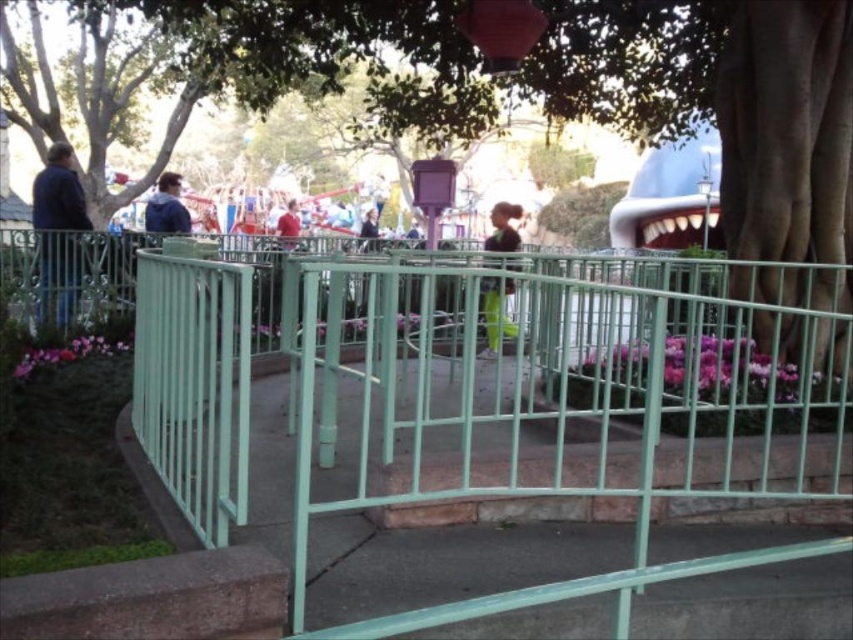
Question: Does red matte shirt at center appear on the left side of light brown leather jacket at center?

Choices:
 (A) yes
 (B) no

Answer: (A)

Question: Estimate the real-world distances between objects in this image. Which object is farther from the blue fabric jacket at upper left?

Choices:
 (A) dark blue jacket at left
 (B) green fabric pants at center

Answer: (B)

Question: Does green fabric pants at center have a smaller size compared to red matte shirt at center?

Choices:
 (A) no
 (B) yes

Answer: (B)

Question: Does red matte shirt at center lie behind light brown leather jacket at center?

Choices:
 (A) no
 (B) yes

Answer: (A)

Question: Which of the following is the closest to the observer?

Choices:
 (A) blue fabric jacket at upper left
 (B) light brown leather jacket at center

Answer: (A)

Question: Estimate the real-world distances between objects in this image. Which object is closer to the dark blue jacket at left?

Choices:
 (A) blue fabric jacket at upper left
 (B) red matte shirt at center
 (C) green fabric pants at center
 (D) light brown leather jacket at center

Answer: (A)